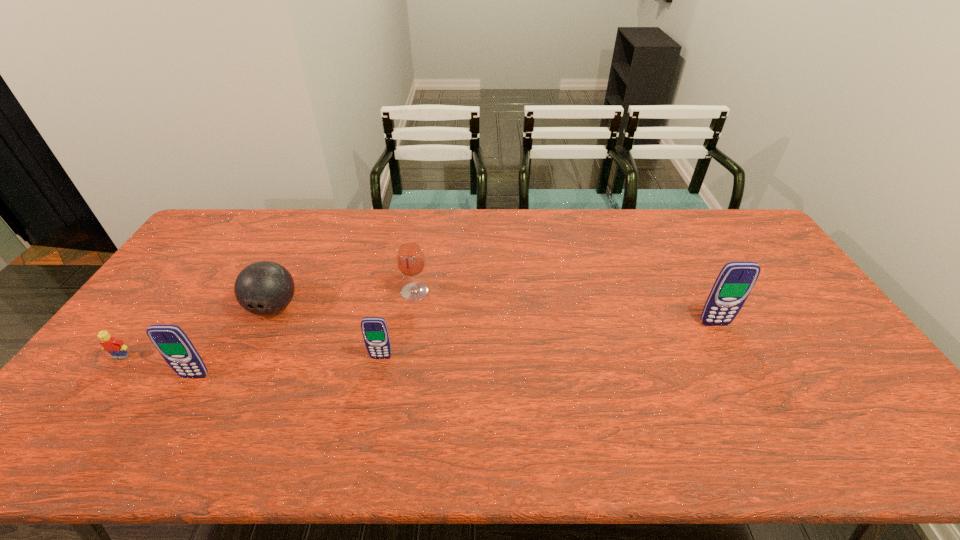
In order to click on free point between the leftmost cellular telephone and the Lego in this screenshot , I will do `click(158, 367)`.

The height and width of the screenshot is (540, 960). What are the coordinates of `free space between the wineglass and the bowling ball` in the screenshot? It's located at pyautogui.click(x=345, y=300).

Where is `free spot between the wineglass and the shortest cellular telephone`? The height and width of the screenshot is (540, 960). free spot between the wineglass and the shortest cellular telephone is located at coordinates (398, 325).

The height and width of the screenshot is (540, 960). In order to click on vacant area that lies between the Lego and the wineglass in this screenshot , I will do `click(268, 325)`.

Image resolution: width=960 pixels, height=540 pixels. What are the coordinates of `free space between the shortest cellular telephone and the rightmost cellular telephone` in the screenshot? It's located at (548, 341).

Where is `free space between the shortest object and the rightmost object`? This screenshot has height=540, width=960. free space between the shortest object and the rightmost object is located at coordinates (418, 340).

At what (x,y) coordinates should I click in order to perform the action: click on vacant region between the tallest cellular telephone and the shortest object. Please return your answer as a coordinate pair (x, y). Image resolution: width=960 pixels, height=540 pixels. Looking at the image, I should click on (418, 340).

This screenshot has width=960, height=540. I want to click on empty location between the wineglass and the second shortest cellular telephone, so click(x=305, y=334).

At what (x,y) coordinates should I click in order to perform the action: click on vacant space that is in between the rightmost cellular telephone and the wineglass. Please return your answer as a coordinate pair (x, y). This screenshot has width=960, height=540. Looking at the image, I should click on (564, 308).

Where is `empty space that is in between the rightmost object and the bowling ball`? empty space that is in between the rightmost object and the bowling ball is located at coordinates (494, 316).